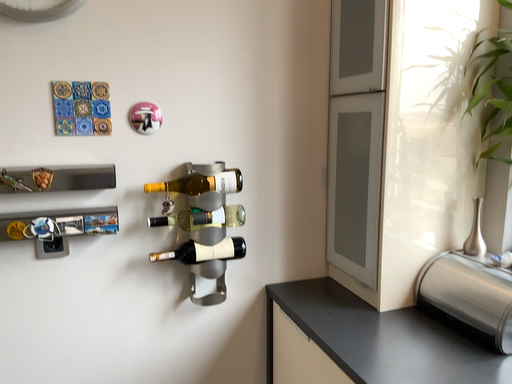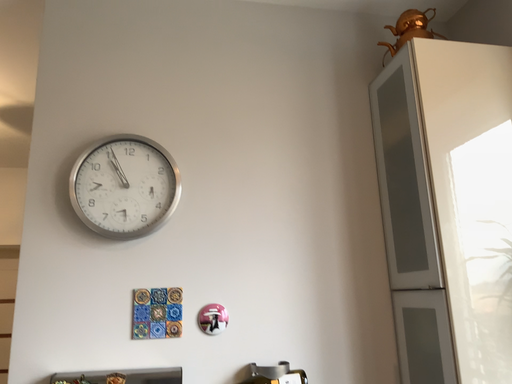
Question: How did the camera likely rotate when shooting the video?

Choices:
 (A) rotated upward
 (B) rotated downward

Answer: (A)